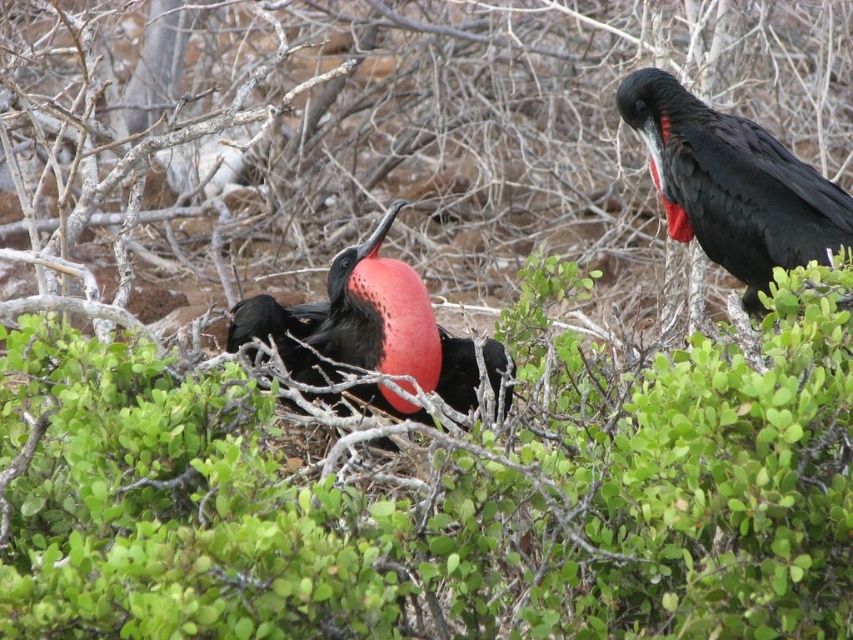
You are a photographer aiming to capture both the green leafy shrub at center and the matte black bird at center in a single frame. Based on their positions, which object is closer to the camera?

The green leafy shrub at center is located below the matte black bird at center, so the matte black bird at center is closer to the camera than the green leafy shrub at center.

You are a wildlife photographer aiming to capture the tallest bird in the scene. Given the presence of the shiny black bird at upper right and the matte black bird at center, which one should you focus on to ensure you photograph the taller bird?

The shiny black bird at upper right is taller than the matte black bird at center, so focusing on the shiny black bird at upper right will ensure you photograph the taller bird.

You are standing at the point labeled point (614,600) and want to take a photo of the two frigatebirds in the image. If your camera has a focal length of 50mm, what is the minimum distance you need to be from the birds to ensure they both fit in the frame?

The minimum distance required is calculated using the formula distance equals focal length multiplied by the subject size divided by the sensor size. However, without knowing the sensor size or the desired field of view, an exact calculation can not be provided. Please provide additional details for an accurate answer.